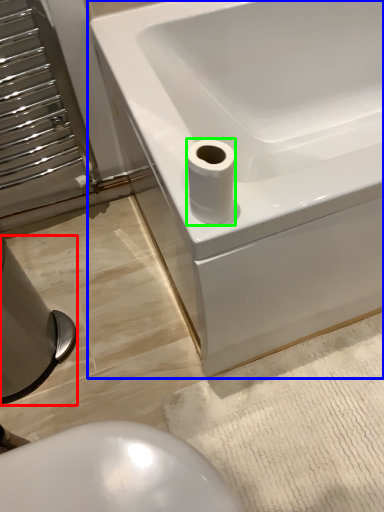
Question: Based on their relative distances, which object is farther from bidet (highlighted by a red box)? Choose from bathtub (highlighted by a blue box) and toilet paper (highlighted by a green box).

Choices:
 (A) bathtub
 (B) toilet paper

Answer: (B)